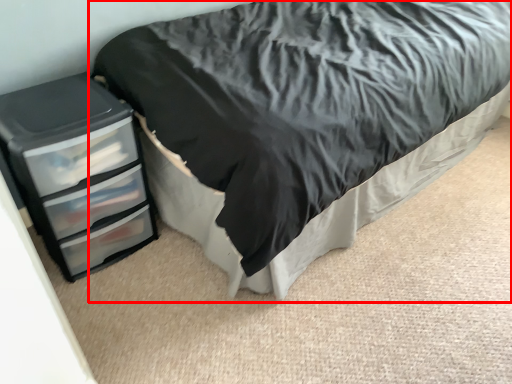
Question: Considering the relative positions of bed (annotated by the red box) and chest of drawers in the image provided, where is bed (annotated by the red box) located with respect to the staircase?

Choices:
 (A) right
 (B) left

Answer: (A)